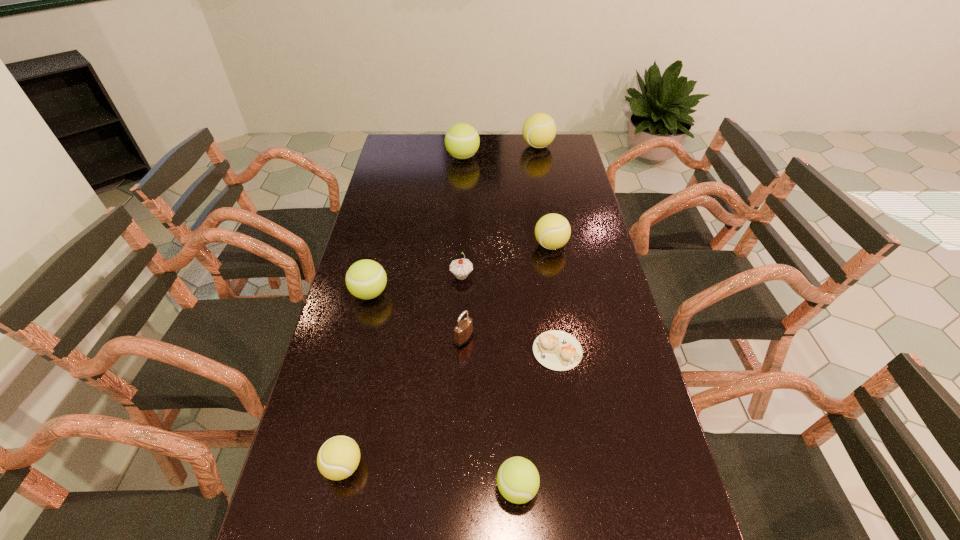
In order to click on vacant space located on the front of the padlock in this screenshot , I will do `click(463, 377)`.

Where is `vacant space situated 0.160m on the right of the smallest yellow tennis ball`? vacant space situated 0.160m on the right of the smallest yellow tennis ball is located at coordinates (435, 466).

Locate an element on the screen. The image size is (960, 540). free point located 0.210m on the left of the rightmost green tennis ball is located at coordinates (398, 488).

Locate an element on the screen. The image size is (960, 540). free location located on the back of the shortest object is located at coordinates coord(547,284).

You are a GUI agent. You are given a task and a screenshot of the screen. Output one action in this format:
    pyautogui.click(x=<x>, y=<y>)
    Task: Click on the cappuccino positioned at the right edge
    The image size is (960, 540).
    Given the screenshot: What is the action you would take?
    pyautogui.click(x=557, y=350)

Where is `object that is at the far right corner`? object that is at the far right corner is located at coordinates tap(539, 130).

At what (x,y) coordinates should I click in order to perform the action: click on free space at the far edge of the desktop. Please return your answer as a coordinate pair (x, y). The image size is (960, 540). Looking at the image, I should click on (492, 146).

Image resolution: width=960 pixels, height=540 pixels. What are the coordinates of `blank space at the left edge of the desktop` in the screenshot? It's located at coord(403,178).

The width and height of the screenshot is (960, 540). In the image, there is a desktop. In order to click on vacant space at the right edge in this screenshot , I will do `click(592, 268)`.

Where is `vacant space at the far left corner`? vacant space at the far left corner is located at coordinates (394, 134).